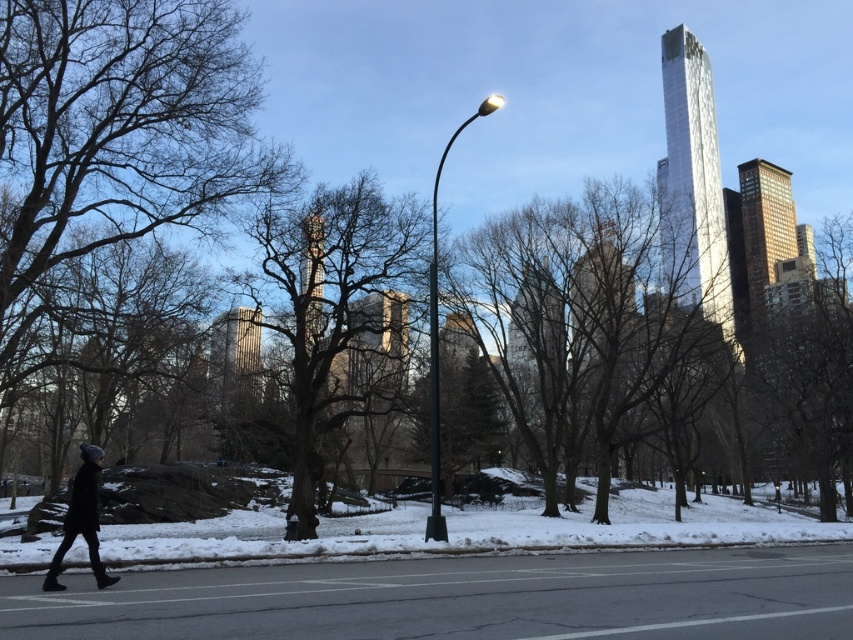
Does brown textured tree at right lie behind black woolen hat at lower left?

Yes, brown textured tree at right is further from the viewer.

Measure the distance between brown textured tree at right and camera.

A distance of 109.71 feet exists between brown textured tree at right and camera.

The image size is (853, 640). What are the coordinates of `brown textured tree at right` in the screenshot? It's located at (810, 369).

Is bare branches at center wider than black woolen hat at lower left?

No, bare branches at center is not wider than black woolen hat at lower left.

Between bare branches at center and black woolen hat at lower left, which one has less height?

black woolen hat at lower left

The width and height of the screenshot is (853, 640). Identify the location of bare branches at center. (332, 301).

Identify the location of bare branches at center. (332, 301).

Can you confirm if bare branches at center is wider than brown textured tree at right?

Incorrect, bare branches at center's width does not surpass brown textured tree at right's.

Between point (305, 285) and point (827, 232), which one is positioned behind?

The point (827, 232) is more distant.

Locate an element on the screen. This screenshot has width=853, height=640. bare branches at center is located at coordinates (332, 301).